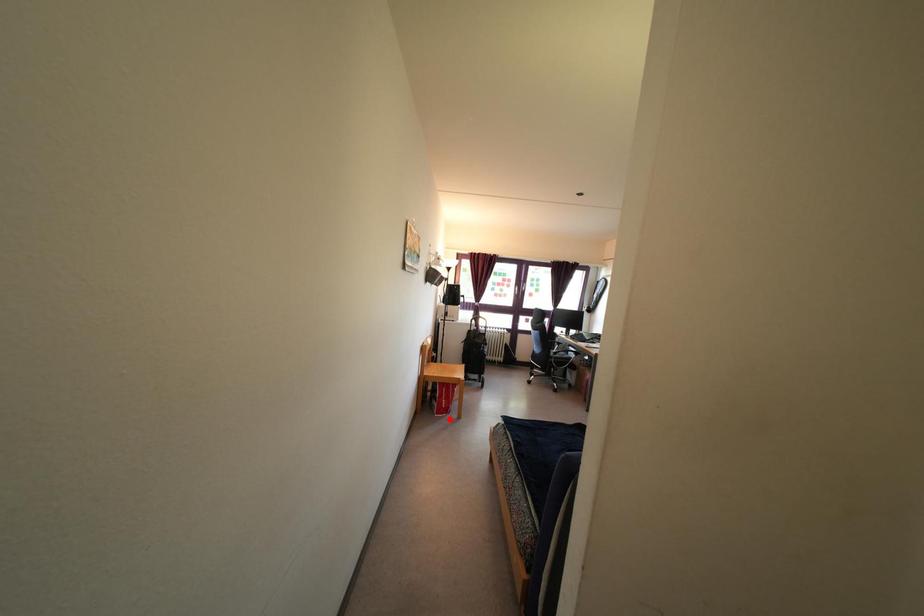
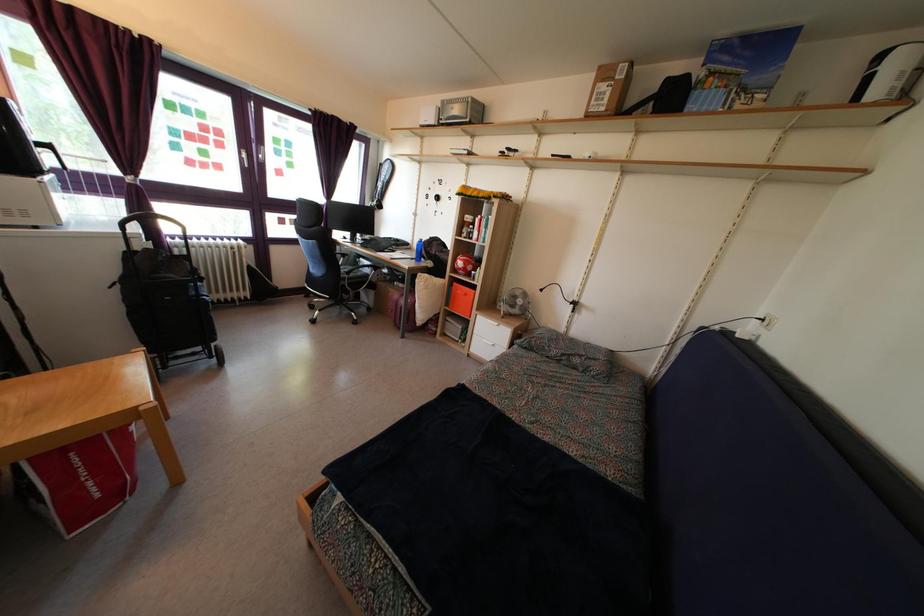
Question: A red point is marked in image1. In image2, is the corresponding 3D point closer to the camera or farther? Reply with the corresponding letter.

Choices:
 (A) The corresponding 3D point is closer.
 (B) The corresponding 3D point is farther.

Answer: (A)